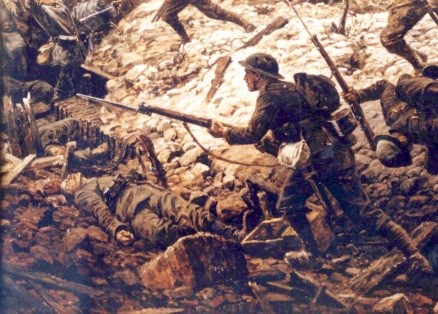
Where is `crate with no lid`? crate with no lid is located at coordinates (262, 230).